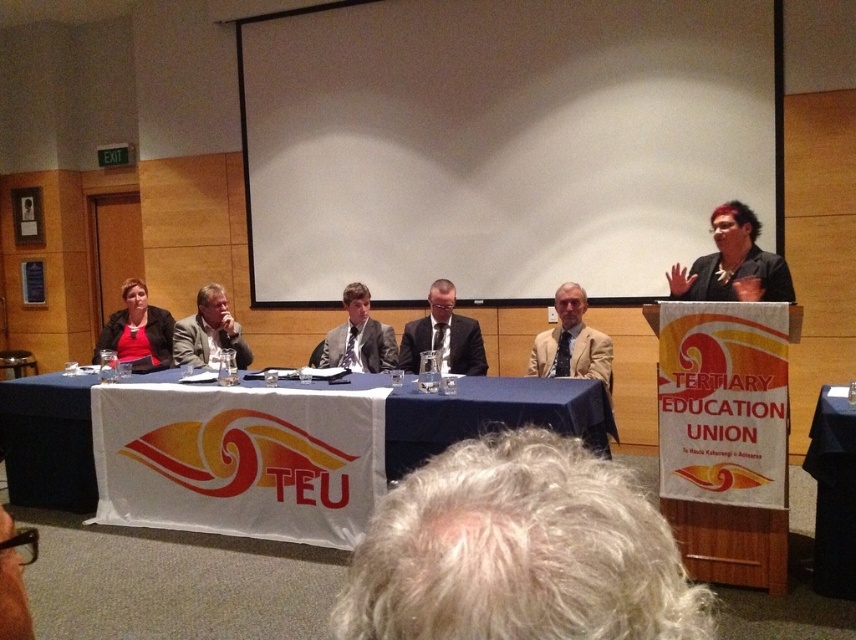
You are a photographer positioned at the back of the room. You need to take a photo of the blue fabric table at center and the matte gray suit at center. Can you fit both subjects into the frame without moving your camera position? Explain your reasoning based on their distance apart.

The distance between the blue fabric table at center and the matte gray suit at center is 3.52 feet. Since both subjects are positioned at the center of the frame and relatively close to each other, it is likely possible to capture both in a single frame without moving the camera, provided the camera has an appropriate focal length and the field of view accommodates this distance.

You are standing at the back of the conference room and want to walk to the panelist table. There are two points marked on the floor in front of you. The first point is at coordinates point (409, 340) and the second is at point (201, 342). Which point is closer to you?

Point (409, 340) is closer to the viewer than point (201, 342), so the first point is closer to you.

You are attending the event and want to know the spatial relationship between the blue fabric table at center and the matte gray suit at center. Which one is closer to the front of the room?

The blue fabric table at center is in front of matte gray suit at center, so the blue fabric table at center is closer to the front of the room.